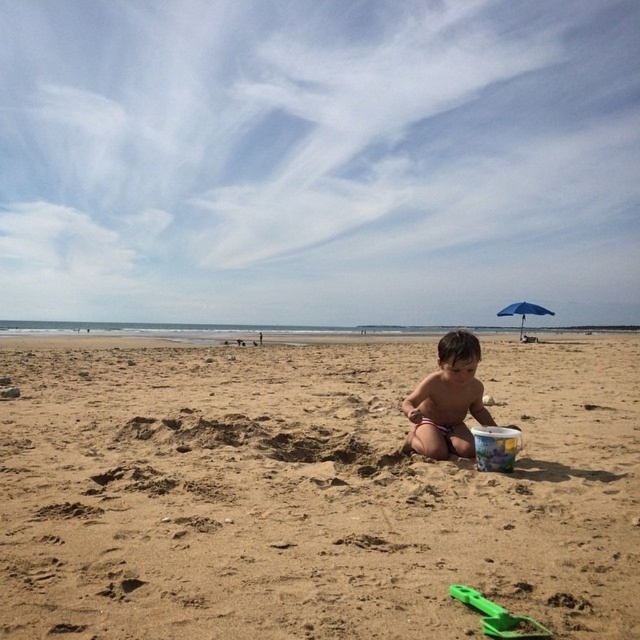
Question: Considering the relative positions of smooth skin child at center and smooth plastic bucket at lower right in the image provided, where is smooth skin child at center located with respect to smooth plastic bucket at lower right?

Choices:
 (A) left
 (B) right

Answer: (A)

Question: Considering the relative positions of brown sandy beach at center and blue fabric umbrella at upper right in the image provided, where is brown sandy beach at center located with respect to blue fabric umbrella at upper right?

Choices:
 (A) left
 (B) right

Answer: (A)

Question: Which is nearer to the brown sandy beach at center?

Choices:
 (A) smooth skin child at center
 (B) green plastic shovel at lower center

Answer: (B)

Question: Which of these objects is positioned farthest from the smooth plastic bucket at lower right?

Choices:
 (A) green plastic shovel at lower center
 (B) blue fabric umbrella at upper right
 (C) brown sandy beach at center
 (D) smooth skin child at center

Answer: (B)

Question: Among these points, which one is nearest to the camera?

Choices:
 (A) (456, 422)
 (B) (483, 598)
 (C) (493, 467)

Answer: (B)

Question: Is brown sandy beach at center behind smooth plastic bucket at lower right?

Choices:
 (A) no
 (B) yes

Answer: (A)